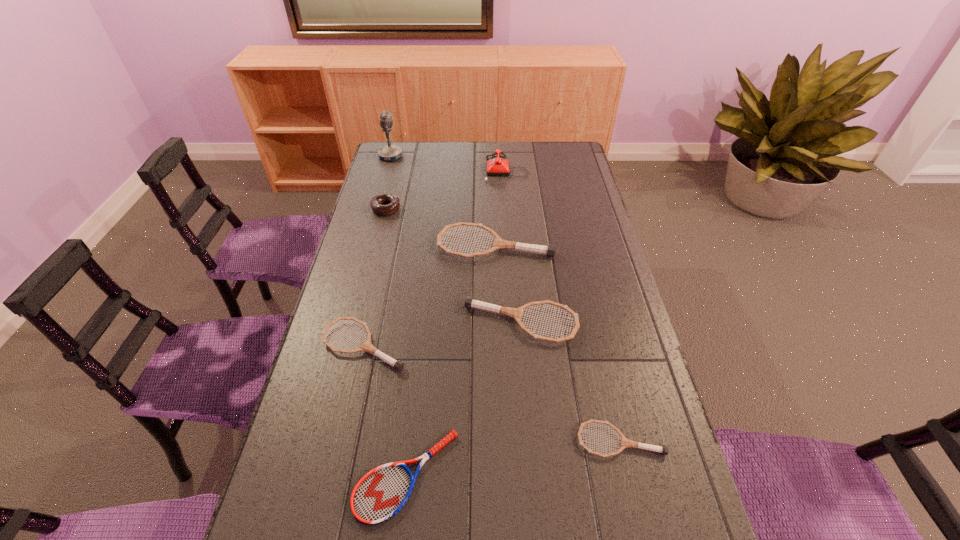
Where is `microphone`? This screenshot has height=540, width=960. microphone is located at coordinates (390, 152).

Locate an element on the screen. Image resolution: width=960 pixels, height=540 pixels. telephone is located at coordinates (495, 167).

Find the location of a particular element. red telephone is located at coordinates (495, 167).

Where is `the farthest gray tennis racket`? The width and height of the screenshot is (960, 540). the farthest gray tennis racket is located at coordinates (499, 243).

At what (x,y) coordinates should I click in order to perform the action: click on the tallest tennis racket. Please return your answer as a coordinate pair (x, y). Looking at the image, I should click on (499, 243).

Find the location of a particular element. the sixth nearest object is located at coordinates (393, 203).

Identify the location of brown doughnut. (393, 203).

What are the coordinates of `the fourth shortest tennis racket` in the screenshot? It's located at (470, 303).

Identify the location of the third tallest tennis racket. (398, 365).

Where is `the leftmost gray tennis racket`? This screenshot has width=960, height=540. the leftmost gray tennis racket is located at coordinates (398, 365).